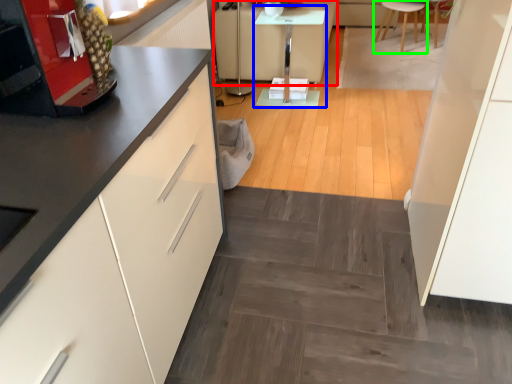
Question: Which is farther away from couch (highlighted by a red box)? table (highlighted by a blue box) or furniture (highlighted by a green box)?

Choices:
 (A) table
 (B) furniture

Answer: (B)